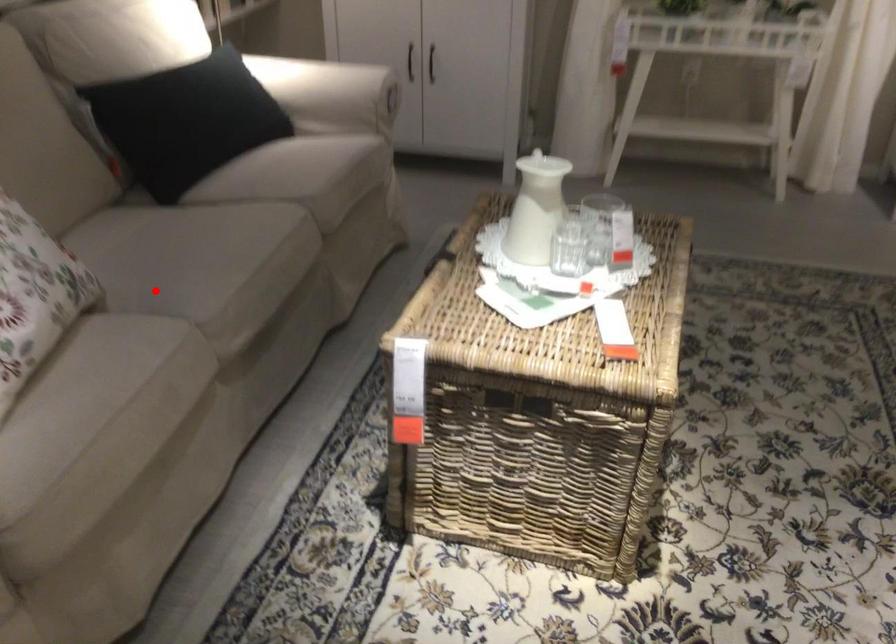
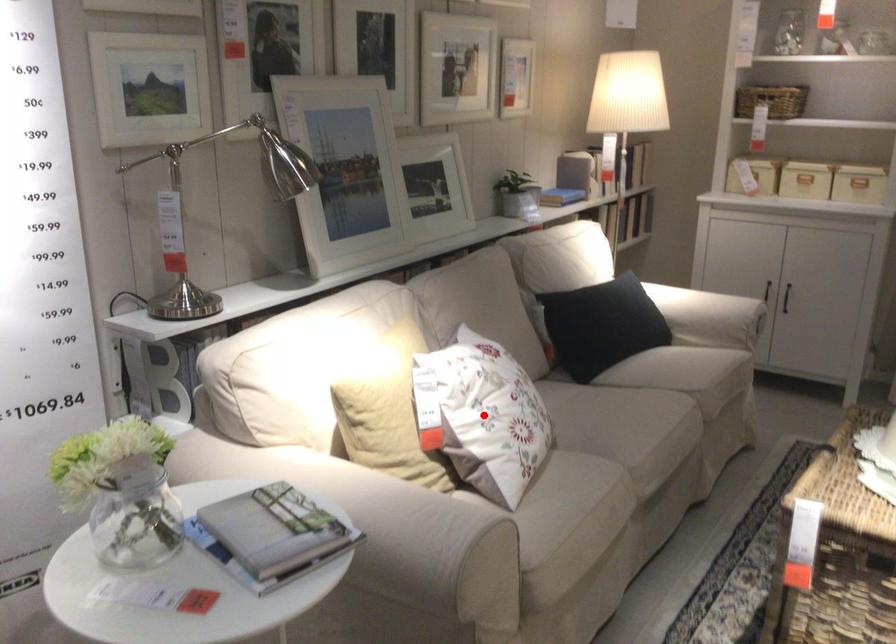
I am providing you with two images of the same scene from different viewpoints. A red point is marked on the first image and another point is marked on the second image. Does the point marked in image1 correspond to the same location as the one in image2?

No